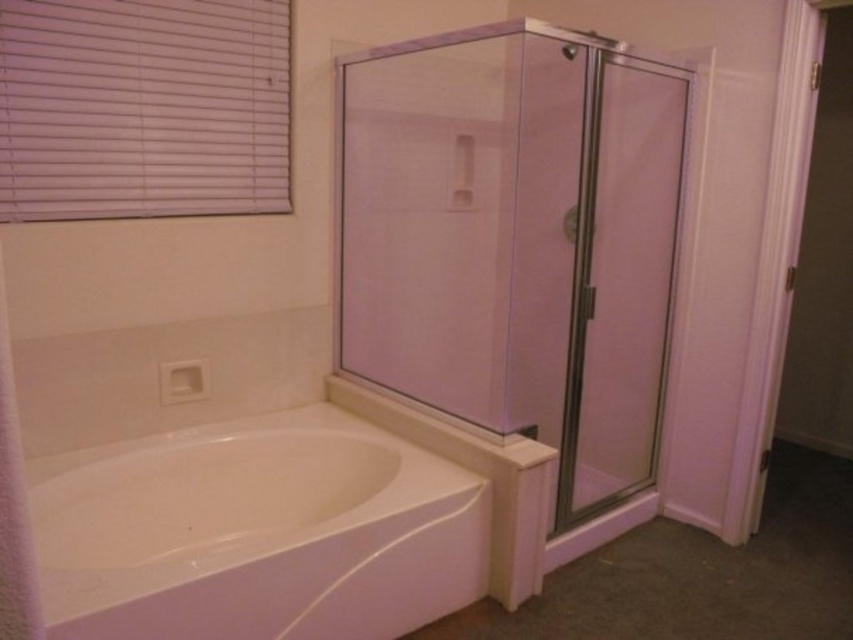
You are in a bathroom and want to open the window to let some fresh air in. The window has white plastic blinds at upper left and there is a white soft towel at left. Which object should you adjust to open the window?

The white plastic blinds at upper left is located above the white soft towel at left. To open the window, you should adjust the white plastic blinds at upper left since it is positioned above the window.

In the scene shown: You are standing in the bathroom and want to locate the clear glass shower door at center. According to the coordinates provided, where exactly is it positioned?

Answer: The clear glass shower door at center is positioned at coordinates point (x=517, y=241).

You are a window cleaner needing to reach the white plastic blinds at upper left and the white soft towel at left. Which object is taller and requires a taller ladder?

The white plastic blinds at upper left is much taller than the white soft towel at left, so you need a taller ladder to reach the white plastic blinds at upper left.